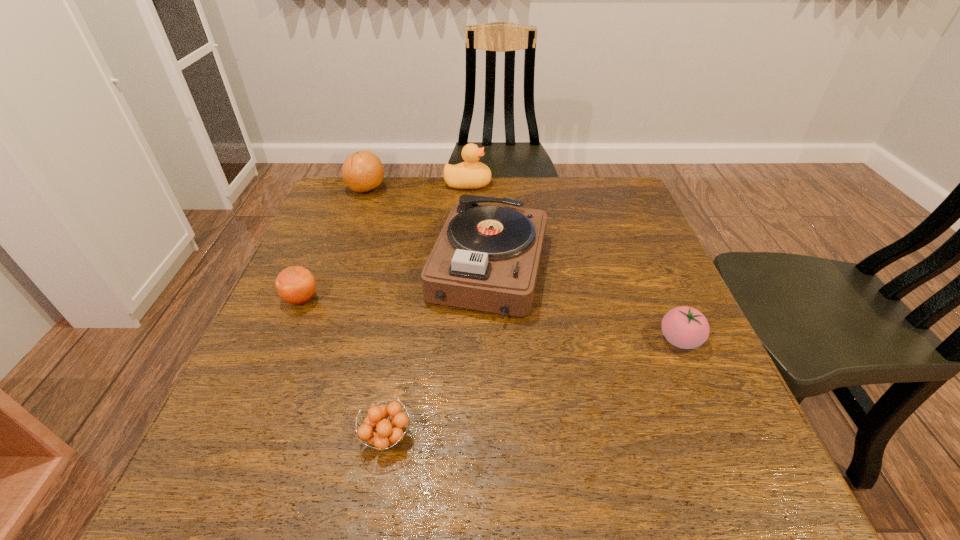
Where is `free spot located 0.130m on the front of the second farthest orange fruit`? free spot located 0.130m on the front of the second farthest orange fruit is located at coordinates (275, 361).

Where is `vacant area located 0.160m on the back of the rightmost object`? vacant area located 0.160m on the back of the rightmost object is located at coordinates (651, 273).

Image resolution: width=960 pixels, height=540 pixels. What are the coordinates of `vacant area situated 0.320m on the back of the rightmost orange fruit` in the screenshot? It's located at [412, 287].

The height and width of the screenshot is (540, 960). Identify the location of duck at the far edge. (471, 174).

The image size is (960, 540). In order to click on orange positioned at the far edge in this screenshot , I will do `click(362, 171)`.

Image resolution: width=960 pixels, height=540 pixels. Identify the location of object present at the near edge. (388, 433).

Locate an element on the screen. The width and height of the screenshot is (960, 540). object located in the right edge section of the desktop is located at coordinates (684, 327).

In order to click on object situated at the far left corner in this screenshot , I will do `click(362, 171)`.

Image resolution: width=960 pixels, height=540 pixels. I want to click on vacant region at the far edge of the desktop, so click(505, 192).

This screenshot has width=960, height=540. What are the coordinates of `vacant space at the near edge of the desktop` in the screenshot? It's located at (442, 475).